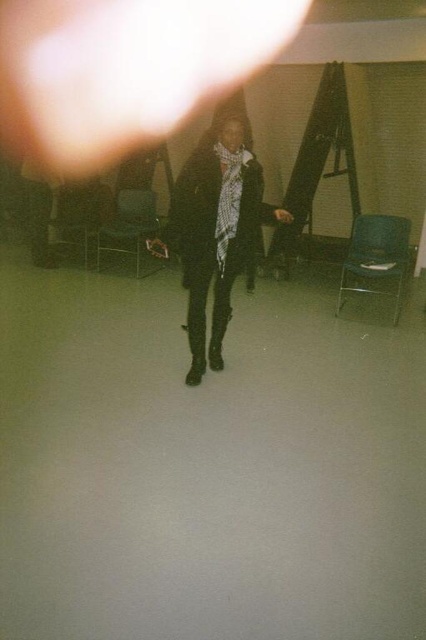
In the image, there is a black matte coat at center. Where exactly is it located in terms of coordinates?

The black matte coat at center is located at point coordinates of (216, 234).

You are standing in the room and want to sit down. The metallic blue chair at right is at coordinates 0.406, 0.883. Can you estimate its position relative to your current location?

The metallic blue chair at right is located at point [376,259], which means it is positioned to the right and slightly forward from your current location in the room.